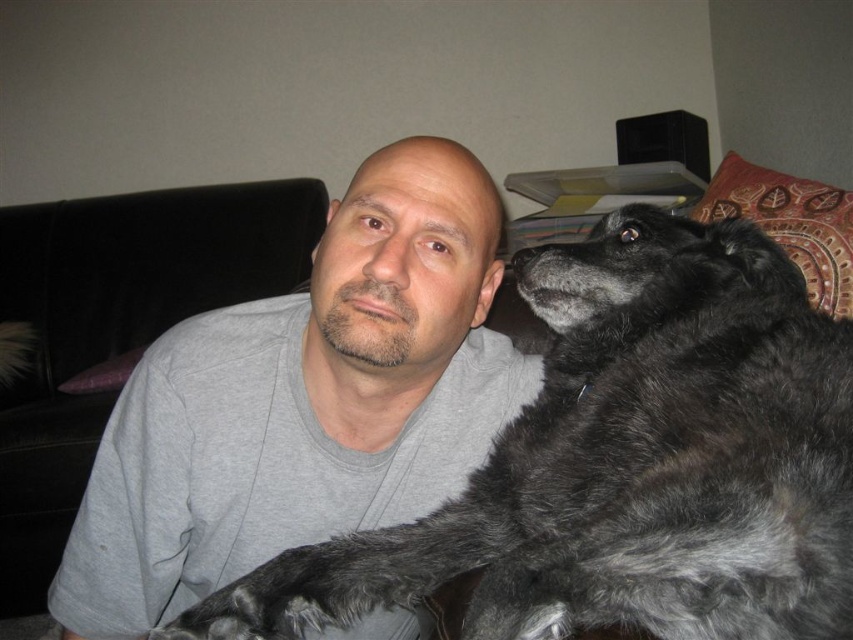
You are a guest in this room and want to sit on the black leather couch at left. Where should you sit relative to the gray cotton shirt at center?

You should sit to the left of the gray cotton shirt at center because the black leather couch at left is located to the left of the gray cotton shirt at center.

You are standing in the room and see two points marked on the wall. The first point is at coordinate point (x=788, y=342) and the second is at point (x=86, y=442). Which point is closer to you?

Point (x=788, y=342) is in front of point (x=86, y=442), so the first point is closer to you.